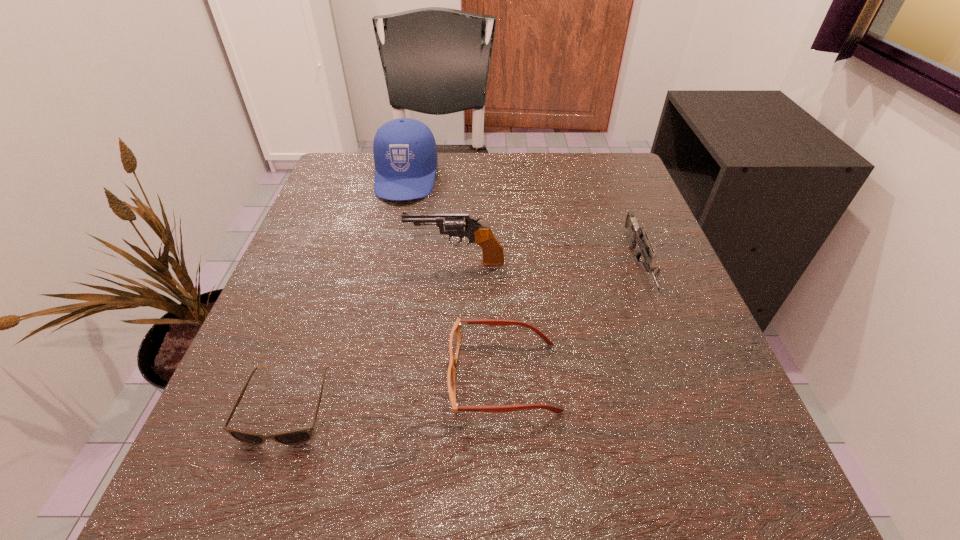
This screenshot has width=960, height=540. In order to click on free space located aimed along the barrel of the shorter gun in this screenshot , I will do `click(684, 385)`.

Where is `vacant space situated 0.310m on the front-facing side of the fourth tallest object`? The width and height of the screenshot is (960, 540). vacant space situated 0.310m on the front-facing side of the fourth tallest object is located at coordinates (239, 377).

Find the location of a particular element. Image resolution: width=960 pixels, height=540 pixels. vacant space situated on the front-facing side of the fourth tallest object is located at coordinates pyautogui.click(x=341, y=377).

Identify the location of vacant region located 0.260m on the front-facing side of the fourth tallest object. (274, 377).

This screenshot has width=960, height=540. Identify the location of free location located 0.080m on the lenses of the shortest object. (251, 514).

Locate an element on the screen. object located in the far edge section of the desktop is located at coordinates (405, 153).

Locate an element on the screen. The image size is (960, 540). cap situated at the left edge is located at coordinates [405, 153].

You are a GUI agent. You are given a task and a screenshot of the screen. Output one action in this format:
    pyautogui.click(x=<x>, y=<y>)
    Task: Click on the sunglasses that is at the left edge
    The image size is (960, 540).
    Given the screenshot: What is the action you would take?
    pyautogui.click(x=295, y=437)

The image size is (960, 540). I want to click on object that is at the right edge, so click(x=636, y=232).

Where is `object situated at the far left corner`? object situated at the far left corner is located at coordinates (405, 153).